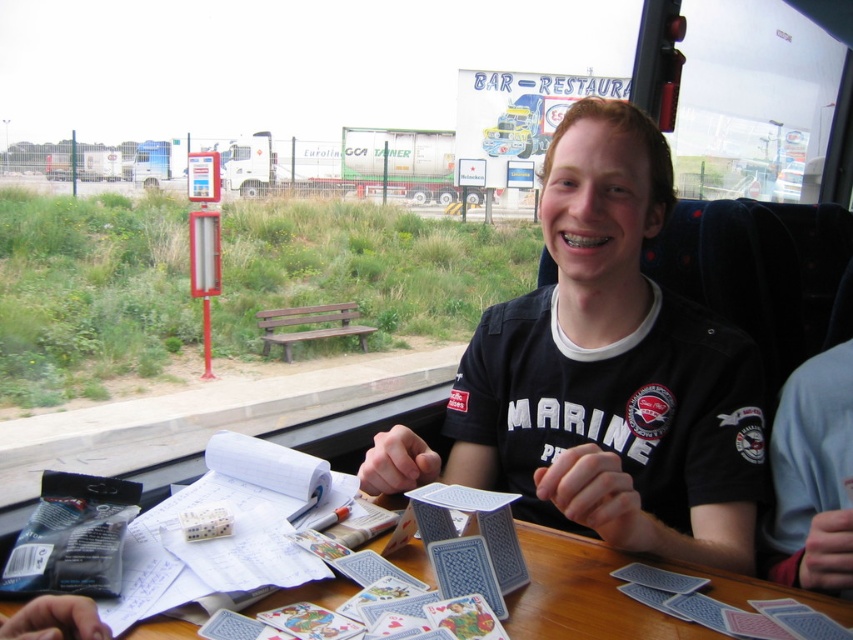
Is blue glossy playing cards at center positioned behind blue plastic table at center?

Yes.

Based on the photo, does blue glossy playing cards at center have a lesser width compared to blue plastic table at center?

Yes, blue glossy playing cards at center is thinner than blue plastic table at center.

Is point (543, 364) more distant than point (300, 593)?

Yes, it is behind point (300, 593).

Find the location of `blue glossy playing cards at center`. blue glossy playing cards at center is located at coordinates (602, 374).

Which of these two, blue fabric shirt at right or blue plastic table at center, stands taller?

With more height is blue fabric shirt at right.

Can you confirm if blue fabric shirt at right is positioned to the right of blue plastic table at center?

Indeed, blue fabric shirt at right is positioned on the right side of blue plastic table at center.

Measure the distance between blue fabric shirt at right and camera.

A distance of 29.45 inches exists between blue fabric shirt at right and camera.

Where is `blue fabric shirt at right`? The height and width of the screenshot is (640, 853). blue fabric shirt at right is located at coordinates (813, 476).

Is blue glossy playing cards at center to the left of blue fabric shirt at right from the viewer's perspective?

Indeed, blue glossy playing cards at center is positioned on the left side of blue fabric shirt at right.

Between blue glossy playing cards at center and blue fabric shirt at right, which one is positioned lower?

blue fabric shirt at right is below.

Image resolution: width=853 pixels, height=640 pixels. I want to click on blue glossy playing cards at center, so click(602, 374).